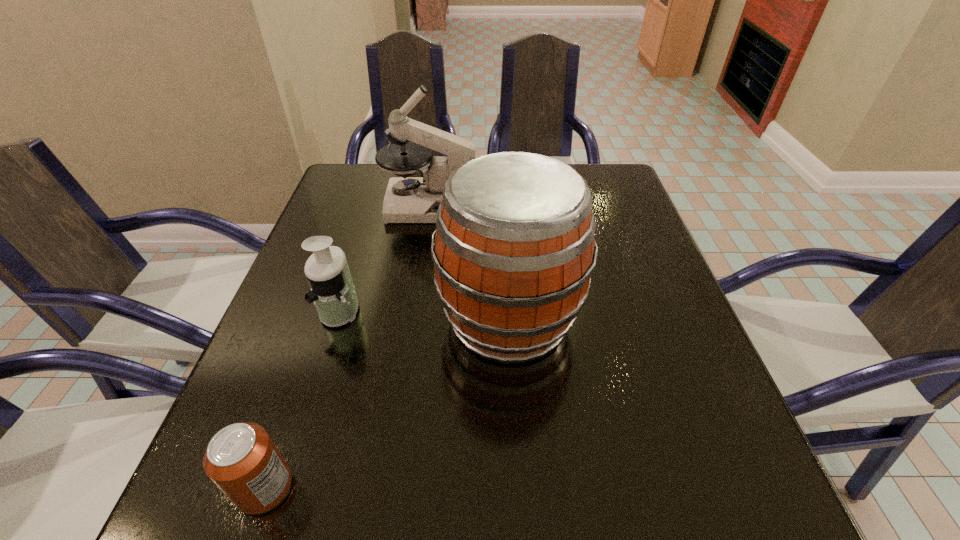
Locate an element on the screen. The width and height of the screenshot is (960, 540). free space in the image that satisfies the following two spatial constraints: 1. at the eyepiece of the farthest object; 2. on the right side of the cider is located at coordinates (415, 320).

The width and height of the screenshot is (960, 540). Identify the location of vacant space that satisfies the following two spatial constraints: 1. at the eyepiece of the cider; 2. on the left side of the microscope. (415, 320).

Where is `free space that satisfies the following two spatial constraints: 1. at the eyepiece of the cider; 2. on the left side of the microscope`? free space that satisfies the following two spatial constraints: 1. at the eyepiece of the cider; 2. on the left side of the microscope is located at coordinates (415, 320).

Find the location of a particular element. free location that satisfies the following two spatial constraints: 1. at the eyepiece of the microscope; 2. on the front side of the can is located at coordinates (391, 488).

Where is `vacant region that satisfies the following two spatial constraints: 1. on the back side of the cider; 2. on the left side of the shortest object`? Image resolution: width=960 pixels, height=540 pixels. vacant region that satisfies the following two spatial constraints: 1. on the back side of the cider; 2. on the left side of the shortest object is located at coordinates (323, 320).